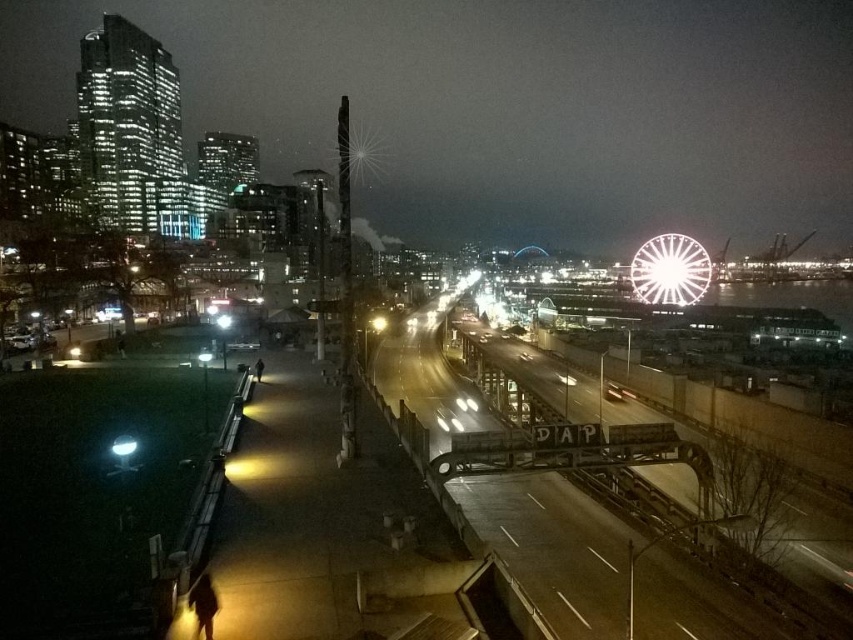
Question: Which object appears closest to the camera in this image?

Choices:
 (A) white metallic ferris wheel at upper right
 (B) metallic bridge at center

Answer: (B)

Question: Is metallic bridge at center to the right of white metallic ferris wheel at upper right from the viewer's perspective?

Choices:
 (A) no
 (B) yes

Answer: (A)

Question: Is the position of metallic bridge at center more distant than that of white metallic ferris wheel at upper right?

Choices:
 (A) no
 (B) yes

Answer: (A)

Question: Which point appears closest to the camera in this image?

Choices:
 (A) (641, 589)
 (B) (660, 260)

Answer: (A)

Question: Is metallic bridge at center bigger than white metallic ferris wheel at upper right?

Choices:
 (A) yes
 (B) no

Answer: (A)